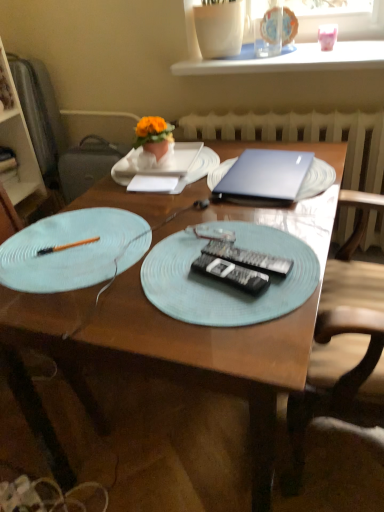
Question: Is orange fabric flower at upper center at the right side of white textured radiator at center?

Choices:
 (A) no
 (B) yes

Answer: (A)

Question: Would you say white textured radiator at center is part of orange fabric flower at upper center's contents?

Choices:
 (A) yes
 (B) no

Answer: (B)

Question: From a real-world perspective, does orange fabric flower at upper center sit lower than white textured radiator at center?

Choices:
 (A) yes
 (B) no

Answer: (B)

Question: From a real-world perspective, is orange fabric flower at upper center on top of white textured radiator at center?

Choices:
 (A) yes
 (B) no

Answer: (A)

Question: Would you say orange fabric flower at upper center is a long distance from white textured radiator at center?

Choices:
 (A) no
 (B) yes

Answer: (A)

Question: Is wooden chair at left, the 2th chair when ordered from right to left, inside the boundaries of blue textured placemat at center, the 3th plate viewed from the back, or outside?

Choices:
 (A) inside
 (B) outside

Answer: (B)

Question: In terms of width, does wooden chair at left, the 2th chair when ordered from right to left, look wider or thinner when compared to blue textured placemat at center, the 1th plate viewed from the front?

Choices:
 (A) thin
 (B) wide

Answer: (B)

Question: From their relative heights in the image, would you say wooden chair at left, positioned as the first chair in left-to-right order, is taller or shorter than blue textured placemat at center, the 3th plate viewed from the back?

Choices:
 (A) tall
 (B) short

Answer: (A)

Question: From the image's perspective, relative to blue textured placemat at center, the 3th plate viewed from the back, is wooden chair at left, positioned as the first chair in left-to-right order, above or below?

Choices:
 (A) above
 (B) below

Answer: (B)

Question: Does point (233, 316) appear closer or farther from the camera than point (110, 305)?

Choices:
 (A) farther
 (B) closer

Answer: (B)

Question: From a real-world perspective, relative to wooden table at center, is blue textured placemat at center, the 3th plate viewed from the back, vertically above or below?

Choices:
 (A) above
 (B) below

Answer: (A)

Question: Considering the positions of blue textured placemat at center, the 1th plate viewed from the front, and wooden table at center in the image, is blue textured placemat at center, the 1th plate viewed from the front, bigger or smaller than wooden table at center?

Choices:
 (A) big
 (B) small

Answer: (B)

Question: Considering their positions, is blue textured placemat at center, the 3th plate viewed from the back, located in front of or behind wooden table at center?

Choices:
 (A) front
 (B) behind

Answer: (B)

Question: From a real-world perspective, is black plastic remote control at center, the second remote control in the top-to-bottom sequence, above or below pink glossy piggy bank at upper right, acting as the first tableware starting from the right?

Choices:
 (A) above
 (B) below

Answer: (B)

Question: Is black plastic remote control at center, the second remote control in the top-to-bottom sequence, wider or thinner than pink glossy piggy bank at upper right, acting as the second tableware starting from the left?

Choices:
 (A) thin
 (B) wide

Answer: (A)